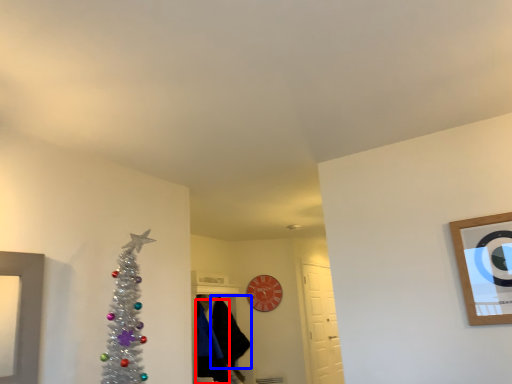
Question: Among these objects, which one is nearest to the camera, robe (highlighted by a red box) or robe (highlighted by a blue box)?

Choices:
 (A) robe
 (B) robe

Answer: (A)